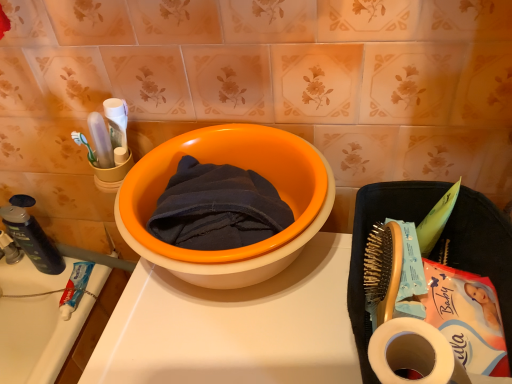
Question: Is dark blue plastic soap dispenser at left, which is the 1th stationery in left-to-right order, bigger than orange plastic basin at center?

Choices:
 (A) no
 (B) yes

Answer: (A)

Question: Is dark blue plastic soap dispenser at left, which is the 1th stationery in left-to-right order, wider than orange plastic basin at center?

Choices:
 (A) yes
 (B) no

Answer: (B)

Question: Does dark blue plastic soap dispenser at left, which is counted as the 2th stationery, starting from the right, touch orange plastic basin at center?

Choices:
 (A) no
 (B) yes

Answer: (A)

Question: From a real-world perspective, is dark blue plastic soap dispenser at left, which is the 1th stationery in left-to-right order, on orange plastic basin at center?

Choices:
 (A) no
 (B) yes

Answer: (A)

Question: Does dark blue plastic soap dispenser at left, which is the 1th stationery in left-to-right order, appear on the right side of orange plastic basin at center?

Choices:
 (A) no
 (B) yes

Answer: (A)

Question: Is orange plastic basin at center wider or thinner than white matte toilet paper at lower right?

Choices:
 (A) thin
 (B) wide

Answer: (B)

Question: From the image's perspective, is orange plastic basin at center above or below white matte toilet paper at lower right?

Choices:
 (A) above
 (B) below

Answer: (A)

Question: From a real-world perspective, is orange plastic basin at center positioned above or below white matte toilet paper at lower right?

Choices:
 (A) above
 (B) below

Answer: (B)

Question: In the image, is orange plastic basin at center positioned in front of or behind white matte toilet paper at lower right?

Choices:
 (A) front
 (B) behind

Answer: (B)

Question: Considering the positions of white matte toilet paper at lower right and dark blue cotton towel at center in the image, is white matte toilet paper at lower right wider or thinner than dark blue cotton towel at center?

Choices:
 (A) wide
 (B) thin

Answer: (B)

Question: From the image's perspective, is white matte toilet paper at lower right above or below dark blue cotton towel at center?

Choices:
 (A) below
 (B) above

Answer: (A)

Question: Which is correct: white matte toilet paper at lower right is inside dark blue cotton towel at center, or outside of it?

Choices:
 (A) inside
 (B) outside

Answer: (B)

Question: Is point (428, 380) positioned closer to the camera than point (210, 238)?

Choices:
 (A) farther
 (B) closer

Answer: (B)

Question: Is dark blue cotton towel at center to the left or to the right of orange plastic basin at center in the image?

Choices:
 (A) left
 (B) right

Answer: (A)

Question: From the image's perspective, relative to orange plastic basin at center, is dark blue cotton towel at center above or below?

Choices:
 (A) above
 (B) below

Answer: (A)